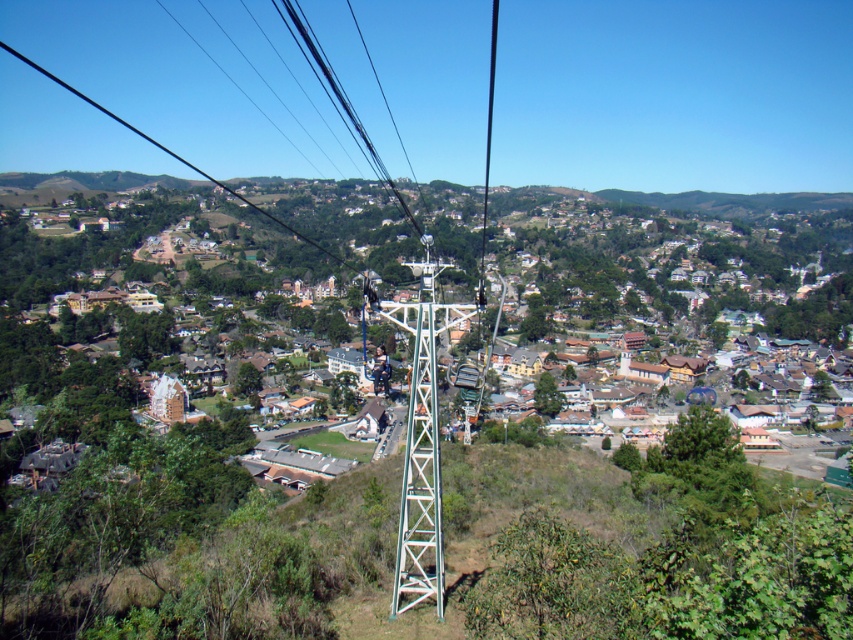
You are a tourist in a cable car and want to take a photo of the brown wooden houses at lower left. The cable car has a window that allows you to see the point at coordinates (670, 260). Will this point show the brown wooden houses at lower left in your photo?

Yes, the point at (670, 260) corresponds to the brown wooden houses at lower left, so the photo will include them.

You are a tourist standing in the cable car and want to take a photo of the brown wooden houses at lower left without the black wire at left appearing in the frame. How should you adjust your camera angle?

The brown wooden houses at lower left is located below the black wire at left. To avoid the black wire at left in the photo, you should tilt your camera downward so that the view focuses on the brown wooden houses at lower left below the wire.

You are a cable car engineer inspecting the structure. You notice the green metallic tower at center and the black cable at center. Which one has a smaller diameter?

The green metallic tower at center is thinner than the black cable at center, so the green metallic tower at center has a smaller diameter.